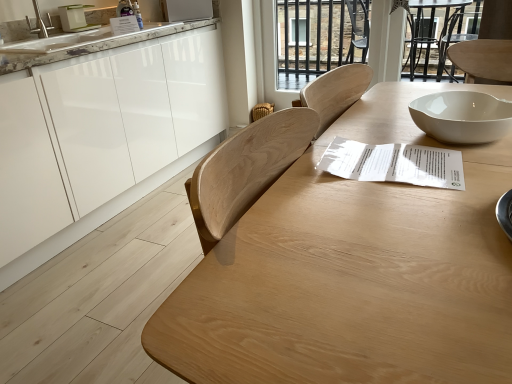
Question: Is transparent glass door at upper center shorter than white marble countertop at upper left?

Choices:
 (A) yes
 (B) no

Answer: (B)

Question: Could white marble countertop at upper left be considered to be inside transparent glass door at upper center?

Choices:
 (A) yes
 (B) no

Answer: (B)

Question: Can you see transparent glass door at upper center touching white marble countertop at upper left?

Choices:
 (A) yes
 (B) no

Answer: (B)

Question: Considering the relative sizes of transparent glass door at upper center and white marble countertop at upper left in the image provided, is transparent glass door at upper center smaller than white marble countertop at upper left?

Choices:
 (A) no
 (B) yes

Answer: (B)

Question: Is there a large distance between transparent glass door at upper center and white marble countertop at upper left?

Choices:
 (A) no
 (B) yes

Answer: (B)

Question: Considering the relative positions of white glossy cabinets at left and natural wood table at center in the image provided, is white glossy cabinets at left to the left or to the right of natural wood table at center?

Choices:
 (A) left
 (B) right

Answer: (A)

Question: In the image, is white glossy cabinets at left positioned in front of or behind natural wood table at center?

Choices:
 (A) front
 (B) behind

Answer: (B)

Question: From the image's perspective, is white glossy cabinets at left located above or below natural wood table at center?

Choices:
 (A) below
 (B) above

Answer: (B)

Question: Is point (176, 79) positioned closer to the camera than point (499, 243)?

Choices:
 (A) closer
 (B) farther

Answer: (B)

Question: Considering the positions of point (186, 11) and point (180, 31), is point (186, 11) closer or farther from the camera than point (180, 31)?

Choices:
 (A) farther
 (B) closer

Answer: (A)

Question: Considering the positions of white glossy microwave at upper center and white marble countertop at upper left in the image, is white glossy microwave at upper center taller or shorter than white marble countertop at upper left?

Choices:
 (A) short
 (B) tall

Answer: (B)

Question: From a real-world perspective, is white glossy microwave at upper center positioned above or below white marble countertop at upper left?

Choices:
 (A) above
 (B) below

Answer: (A)

Question: Relative to white marble countertop at upper left, is white glossy microwave at upper center in front or behind?

Choices:
 (A) front
 (B) behind

Answer: (B)

Question: Based on their positions, is woven straw chair at center located to the left or right of transparent glass door at upper center?

Choices:
 (A) left
 (B) right

Answer: (A)

Question: From their relative heights in the image, would you say woven straw chair at center is taller or shorter than transparent glass door at upper center?

Choices:
 (A) tall
 (B) short

Answer: (B)